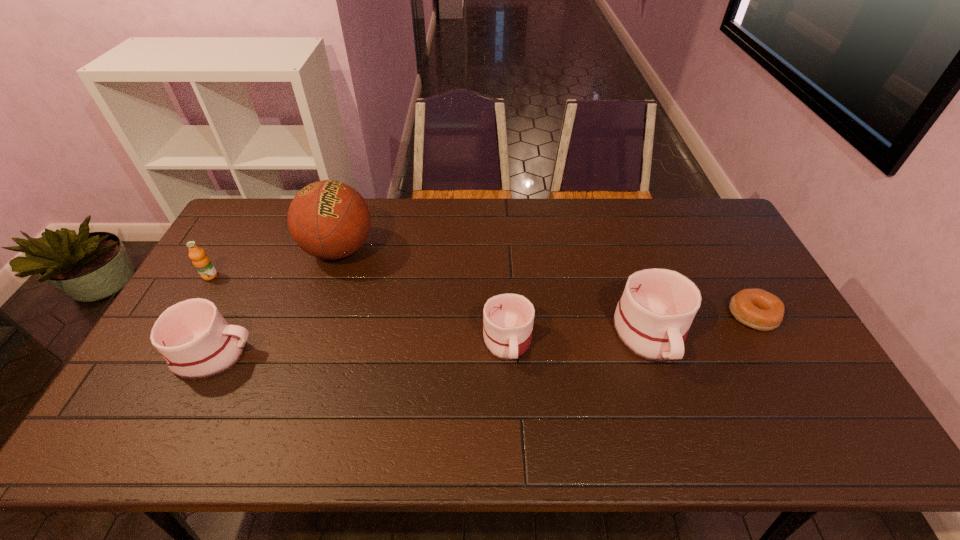
This screenshot has height=540, width=960. I want to click on the second tallest mug, so click(x=195, y=340).

Identify the location of the fifth tallest object. The image size is (960, 540). (508, 318).

You are a GUI agent. You are given a task and a screenshot of the screen. Output one action in this format:
    pyautogui.click(x=<x>, y=<y>)
    Task: Click on the shortest mug
    The width and height of the screenshot is (960, 540).
    Given the screenshot: What is the action you would take?
    pyautogui.click(x=508, y=318)

Find the location of a particular element. This screenshot has width=960, height=540. the second object from right to left is located at coordinates (652, 319).

The image size is (960, 540). I want to click on the tallest object, so click(328, 219).

Where is `basketball`? basketball is located at coordinates (328, 219).

Where is `orange juice`? The height and width of the screenshot is (540, 960). orange juice is located at coordinates (202, 263).

I want to click on bagel, so click(x=758, y=309).

Locate an element on the screen. Image resolution: width=960 pixels, height=540 pixels. the rightmost object is located at coordinates point(758,309).

Identify the location of free region located on the side with the handle of the second tallest mug. (336, 354).